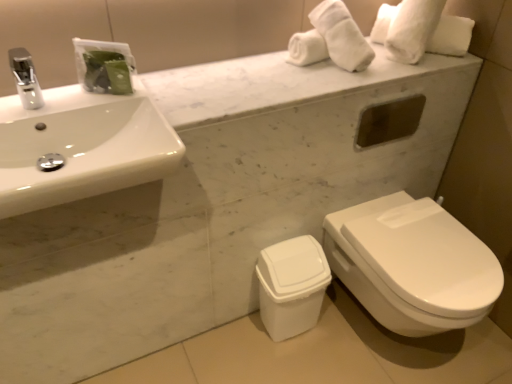
The width and height of the screenshot is (512, 384). What are the coordinates of `free space between white glossy toilet at lower right and white plastic trash can at lower center` in the screenshot? It's located at click(x=321, y=356).